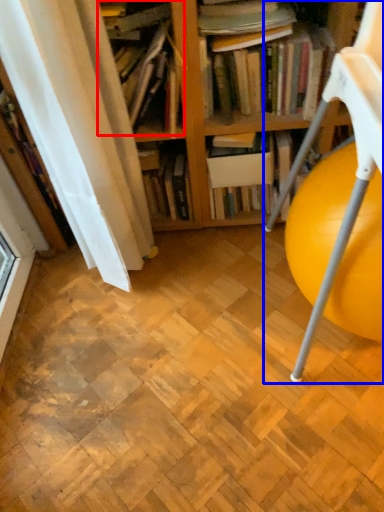
Question: Which object appears closest to the camera in this image, book (highlighted by a red box) or rocking chair (highlighted by a blue box)?

Choices:
 (A) book
 (B) rocking chair

Answer: (B)